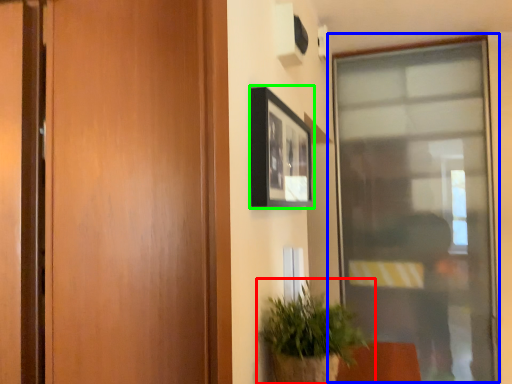
Question: Which object is positioned closest to houseplant (highlighted by a red box)? Select from window (highlighted by a blue box) and picture frame (highlighted by a green box).

Choices:
 (A) window
 (B) picture frame

Answer: (B)